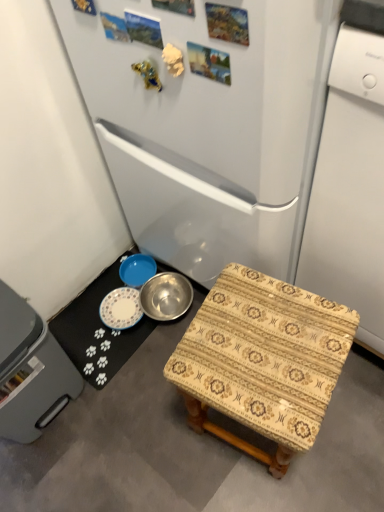
Question: Considering the positions of metallic silver bowl at lower center and patterned fabric stool at lower right in the image, is metallic silver bowl at lower center taller or shorter than patterned fabric stool at lower right?

Choices:
 (A) tall
 (B) short

Answer: (B)

Question: In terms of size, does metallic silver bowl at lower center appear bigger or smaller than patterned fabric stool at lower right?

Choices:
 (A) big
 (B) small

Answer: (B)

Question: Which object is positioned farthest from the gray plastic dishwasher at lower left?

Choices:
 (A) metallic silver bowl at lower center
 (B) patterned fabric stool at lower right
 (C) white glossy dishwasher at right
 (D) white glossy refrigerator at center
 (E) metallic silver bowl at lower left

Answer: (C)

Question: Which object is the closest to the white glossy refrigerator at center?

Choices:
 (A) white glossy dishwasher at right
 (B) gray plastic dishwasher at lower left
 (C) metallic silver bowl at lower center
 (D) patterned fabric stool at lower right
 (E) metallic silver bowl at lower left

Answer: (A)